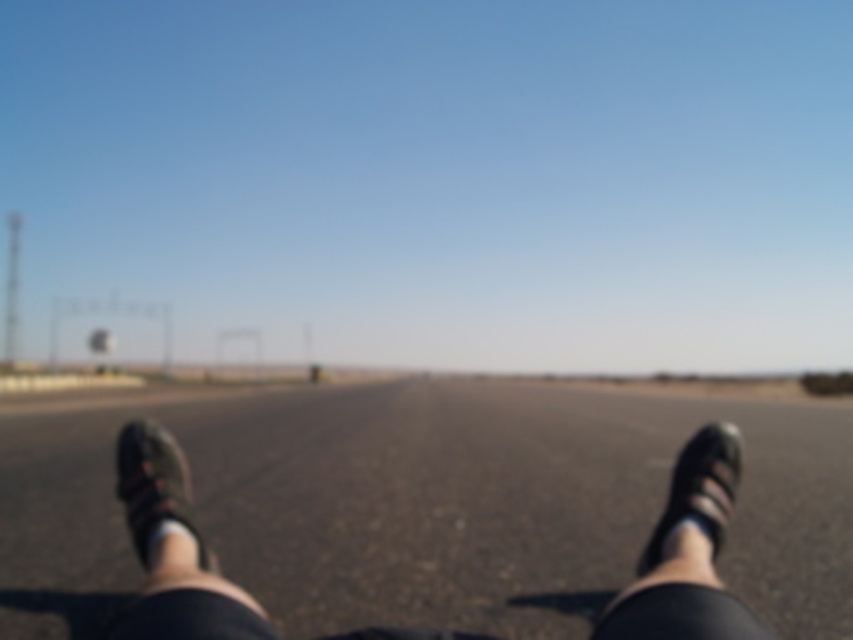
Is black suede shoe at lower right thinner than white fabric sock at lower center?

Incorrect, black suede shoe at lower right's width is not less than white fabric sock at lower center's.

The image size is (853, 640). What do you see at coordinates (700, 488) in the screenshot? I see `black suede shoe at lower right` at bounding box center [700, 488].

Does point (688, 449) lie in front of point (149, 560)?

That is False.

Locate an element on the screen. This screenshot has width=853, height=640. black suede shoe at lower right is located at coordinates (700, 488).

Looking at this image, between matte brown sandal at lower left and black suede shoe at lower right, which one is positioned higher?

black suede shoe at lower right is higher up.

Is point (202, 560) in front of point (708, 486)?

Yes, point (202, 560) is closer to viewer.

Is point (177, 449) farther from viewer compared to point (659, 538)?

That is True.

This screenshot has width=853, height=640. I want to click on matte brown sandal at lower left, so click(154, 484).

Does asphalt road at center appear under matte brown sandal at lower left?

Correct, asphalt road at center is located below matte brown sandal at lower left.

Who is taller, asphalt road at center or matte brown sandal at lower left?

Standing taller between the two is asphalt road at center.

At what (x,y) coordinates should I click in order to perform the action: click on asphalt road at center. Please return your answer as a coordinate pair (x, y). Looking at the image, I should click on (428, 506).

Where is `asphalt road at center`? The image size is (853, 640). asphalt road at center is located at coordinates (428, 506).